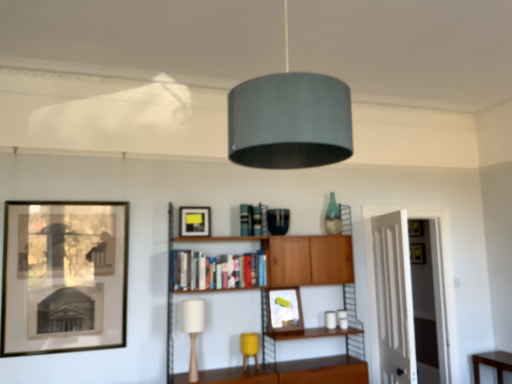
Question: Is hardcover books at center placed right next to matte black picture frame at left, the third picture frame positioned from the right?

Choices:
 (A) yes
 (B) no

Answer: (B)

Question: Can you confirm if hardcover books at center is wider than matte black picture frame at left, which is the 1th picture frame from left to right?

Choices:
 (A) yes
 (B) no

Answer: (A)

Question: Does hardcover books at center appear on the left side of matte black picture frame at left, which is the 3th picture frame in back-to-front order?

Choices:
 (A) yes
 (B) no

Answer: (B)

Question: From the image's perspective, is hardcover books at center on top of matte black picture frame at left, which is the 3th picture frame in back-to-front order?

Choices:
 (A) no
 (B) yes

Answer: (B)

Question: From a real-world perspective, is hardcover books at center under matte black picture frame at left, which ranks as the 1th picture frame in front-to-back order?

Choices:
 (A) yes
 (B) no

Answer: (B)

Question: Is hardcover books at center thinner than matte black picture frame at left, which is the 3th picture frame in back-to-front order?

Choices:
 (A) no
 (B) yes

Answer: (A)

Question: Is yellow fabric table lamp at lower center, the 1th table lamp viewed from the back, oriented towards matte silver picture frame at center, positioned as the 1th picture frame in right-to-left order?

Choices:
 (A) no
 (B) yes

Answer: (A)

Question: Can you confirm if yellow fabric table lamp at lower center, the 1th table lamp viewed from the back, is bigger than matte silver picture frame at center, positioned as the 1th picture frame in right-to-left order?

Choices:
 (A) yes
 (B) no

Answer: (B)

Question: Can you confirm if yellow fabric table lamp at lower center, the 1th table lamp viewed from the back, is thinner than matte silver picture frame at center, positioned as the 1th picture frame in right-to-left order?

Choices:
 (A) yes
 (B) no

Answer: (B)

Question: Does yellow fabric table lamp at lower center, the 2th table lamp positioned from the front, appear on the right side of matte silver picture frame at center, which ranks as the third picture frame in left-to-right order?

Choices:
 (A) no
 (B) yes

Answer: (A)

Question: From a real-world perspective, is yellow fabric table lamp at lower center, the 1th table lamp from the right, below matte silver picture frame at center, which ranks as the third picture frame in left-to-right order?

Choices:
 (A) no
 (B) yes

Answer: (B)

Question: Is yellow fabric table lamp at lower center, the 1th table lamp from the right, at the left side of matte silver picture frame at center, which ranks as the third picture frame in left-to-right order?

Choices:
 (A) no
 (B) yes

Answer: (B)

Question: From the image's perspective, is white wood door at right on top of yellow fabric table lamp at lower center, marked as the 2th table lamp in a left-to-right arrangement?

Choices:
 (A) no
 (B) yes

Answer: (B)